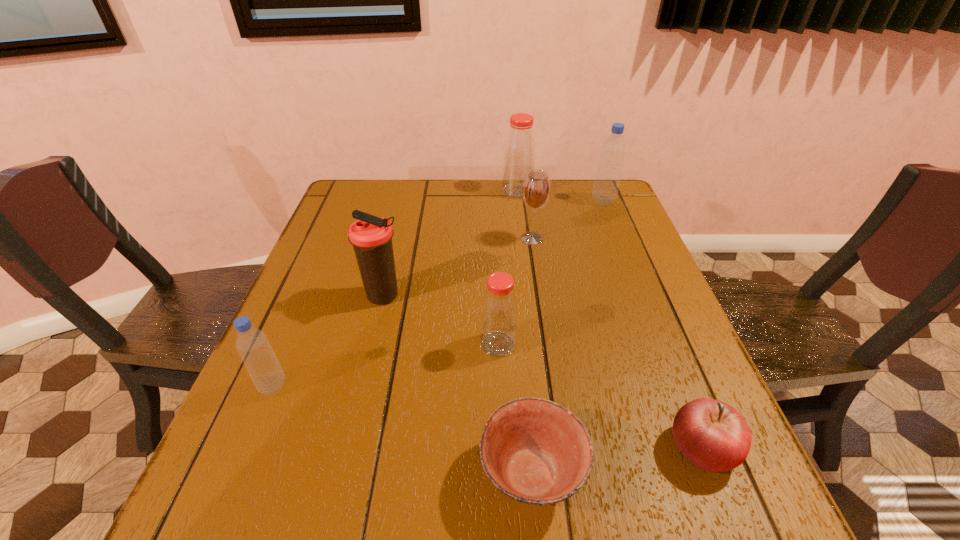
Find the location of a particular element. The width and height of the screenshot is (960, 540). free space at the right edge of the desktop is located at coordinates (601, 230).

You are a GUI agent. You are given a task and a screenshot of the screen. Output one action in this format:
    pyautogui.click(x=<x>, y=<y>)
    Task: Click on the free space at the far left corner of the desktop
    The width and height of the screenshot is (960, 540).
    Given the screenshot: What is the action you would take?
    pyautogui.click(x=343, y=220)

In order to click on vacant region at the far right corner of the desktop in this screenshot , I will do `click(597, 213)`.

Locate an element on the screen. The height and width of the screenshot is (540, 960). vacant area between the red wineglass and the leftmost bottle is located at coordinates pyautogui.click(x=402, y=312).

Where is `free area in between the third farthest object and the bowl`? This screenshot has height=540, width=960. free area in between the third farthest object and the bowl is located at coordinates (532, 356).

Where is `free spot between the apple and the nearest bottle`? Image resolution: width=960 pixels, height=540 pixels. free spot between the apple and the nearest bottle is located at coordinates (488, 417).

Locate an element on the screen. free space between the farther blue bottle and the nearer red bottle is located at coordinates point(550,273).

Where is `empty space that is in between the nearer blue bottle and the bowl`? The height and width of the screenshot is (540, 960). empty space that is in between the nearer blue bottle and the bowl is located at coordinates tap(402, 430).

Locate an element on the screen. The height and width of the screenshot is (540, 960). vacant area that lies between the shortest object and the farther blue bottle is located at coordinates (567, 337).

Image resolution: width=960 pixels, height=540 pixels. I want to click on empty location between the bigger red bottle and the fifth farthest object, so click(x=508, y=268).